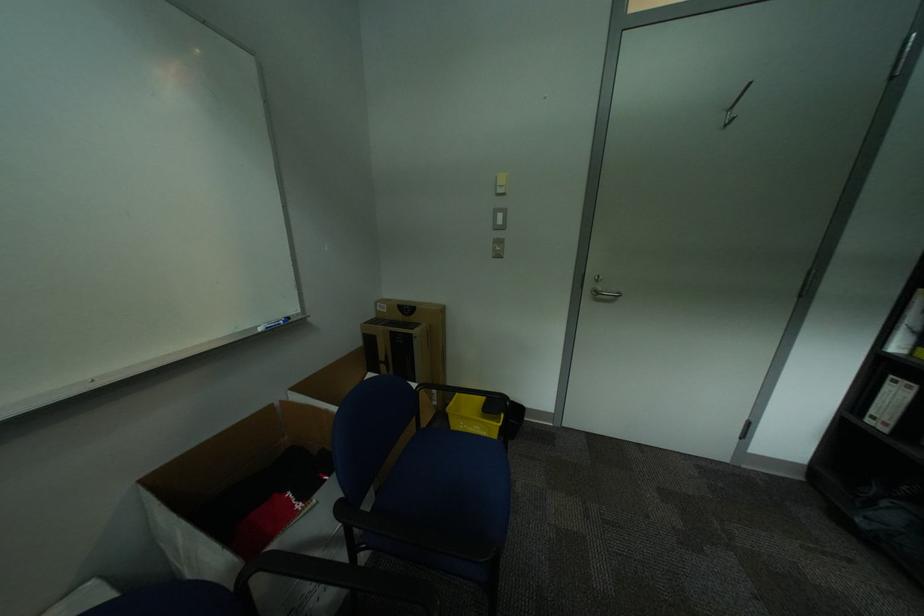
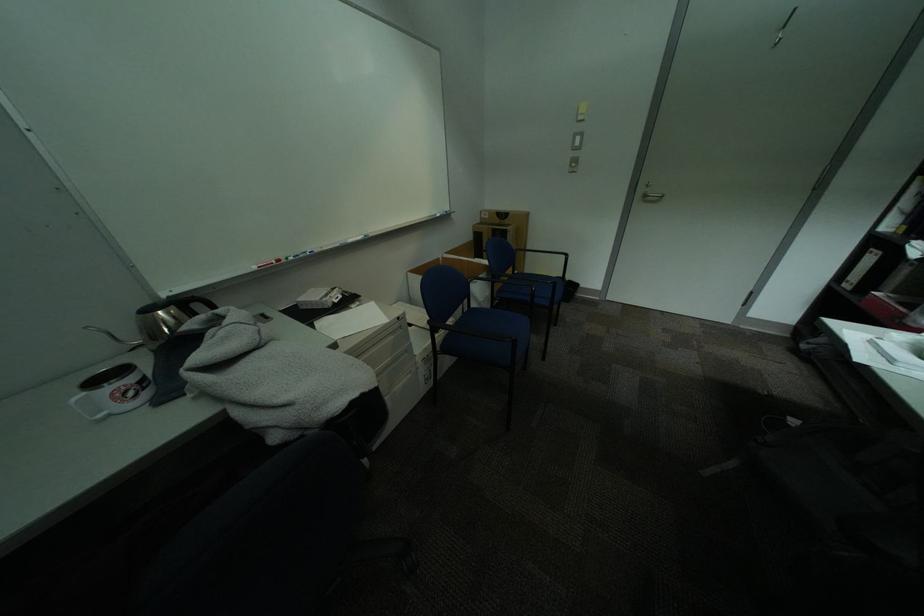
The point at (x=882, y=414) is marked in the first image. Where is the corresponding point in the second image?

(859, 280)